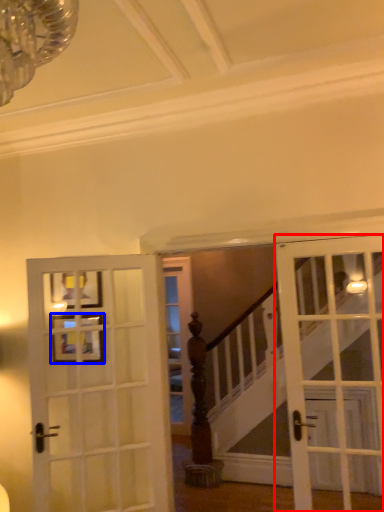
Question: Which of the following is the closest to the observer, door (highlighted by a red box) or picture frame (highlighted by a blue box)?

Choices:
 (A) door
 (B) picture frame

Answer: (A)